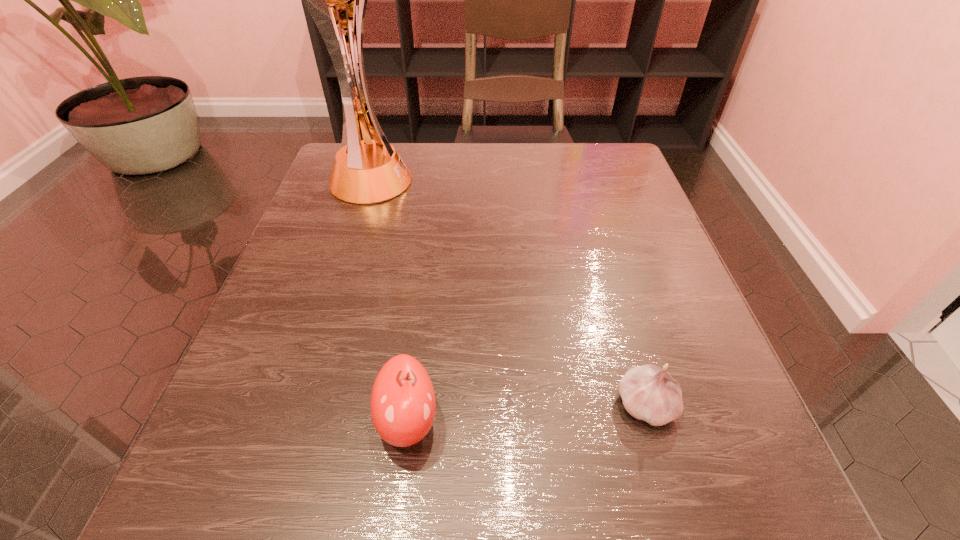
This screenshot has width=960, height=540. I want to click on free point that satisfies the following two spatial constraints: 1. on the back side of the garlic; 2. on the right side of the second object from left to right, so click(x=410, y=405).

In order to click on free space in the image that satisfies the following two spatial constraints: 1. on the front-facing side of the second object from left to right; 2. on the right side of the trophy in this screenshot , I will do `click(291, 421)`.

This screenshot has width=960, height=540. I want to click on free point that satisfies the following two spatial constraints: 1. on the front-facing side of the farthest object; 2. on the left side of the apple, so click(x=291, y=421).

You are a GUI agent. You are given a task and a screenshot of the screen. Output one action in this format:
    pyautogui.click(x=<x>, y=<y>)
    Task: Click on the free space that satisfies the following two spatial constraints: 1. on the back side of the apple; 2. on the front-facing side of the leftmost object
    
    Given the screenshot: What is the action you would take?
    click(437, 182)

Identify the location of free location that satisfies the following two spatial constraints: 1. on the back side of the second object from left to right; 2. on the right side of the garlic. The height and width of the screenshot is (540, 960). (410, 405).

Where is `free space that satisfies the following two spatial constraints: 1. on the front-facing side of the rightmost object; 2. on the left side of the leftmost object`? free space that satisfies the following two spatial constraints: 1. on the front-facing side of the rightmost object; 2. on the left side of the leftmost object is located at coordinates (296, 405).

In order to click on vacant space that satisfies the following two spatial constraints: 1. on the front-facing side of the farthest object; 2. on the back side of the garlic in this screenshot , I will do `click(296, 405)`.